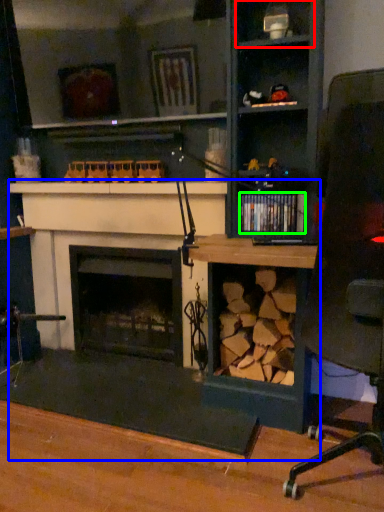
Question: Considering the real-world distances, which object is farthest from shelf (highlighted by a red box)? computer desk (highlighted by a blue box) or book (highlighted by a green box)?

Choices:
 (A) computer desk
 (B) book

Answer: (A)